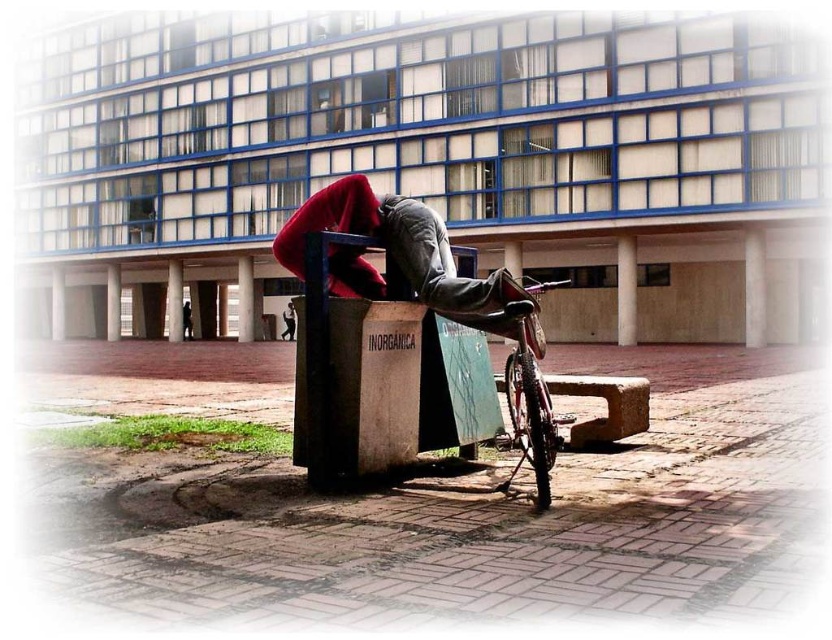
In the scene shown: You are a city planner analyzing the urban plaza depicted. You notice the red fabric at center and dark gray jeans at center. Based on their positions, which object is closer to the viewer?

The red fabric at center is located above the dark gray jeans at center, meaning it is closer to the viewer.

You are a delivery person who needs to load a package onto the shiny metallic bicycle at lower right. The package is as big as the dark gray jeans at lower center. Will the package fit on the bicycle?

The shiny metallic bicycle at lower right has a larger size compared to dark gray jeans at lower center, so the package will fit on the bicycle since it is smaller than the bicycle.